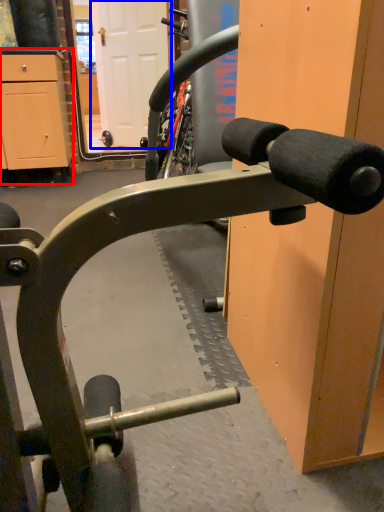
Question: Which object is further to the camera taking this photo, cabinetry (highlighted by a red box) or door (highlighted by a blue box)?

Choices:
 (A) cabinetry
 (B) door

Answer: (B)